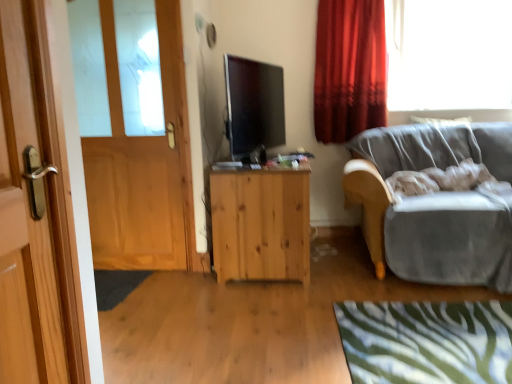
Identify the location of spots to the right of wooden door at left, which is the first door from back to front. This screenshot has height=384, width=512. (183, 279).